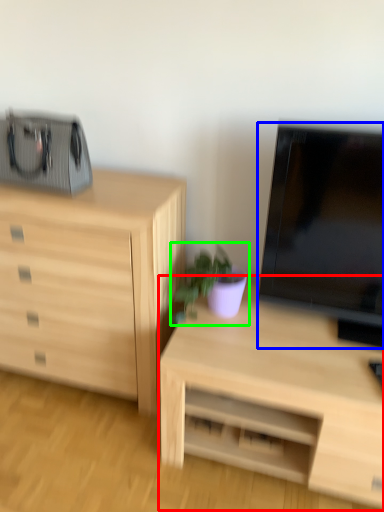
Question: Based on their relative distances, which object is nearer to desk (highlighted by a red box)? Choose from television (highlighted by a blue box) and houseplant (highlighted by a green box).

Choices:
 (A) television
 (B) houseplant

Answer: (B)